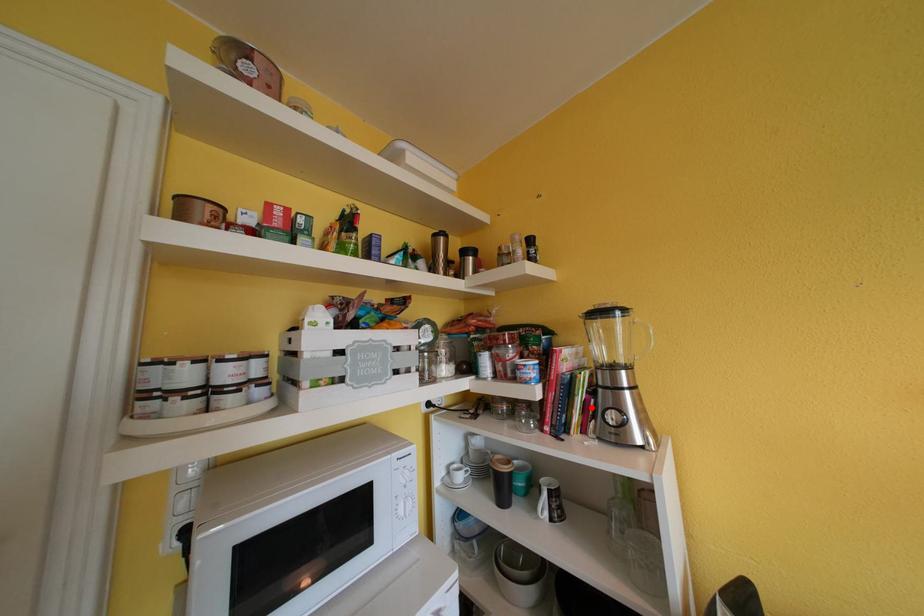
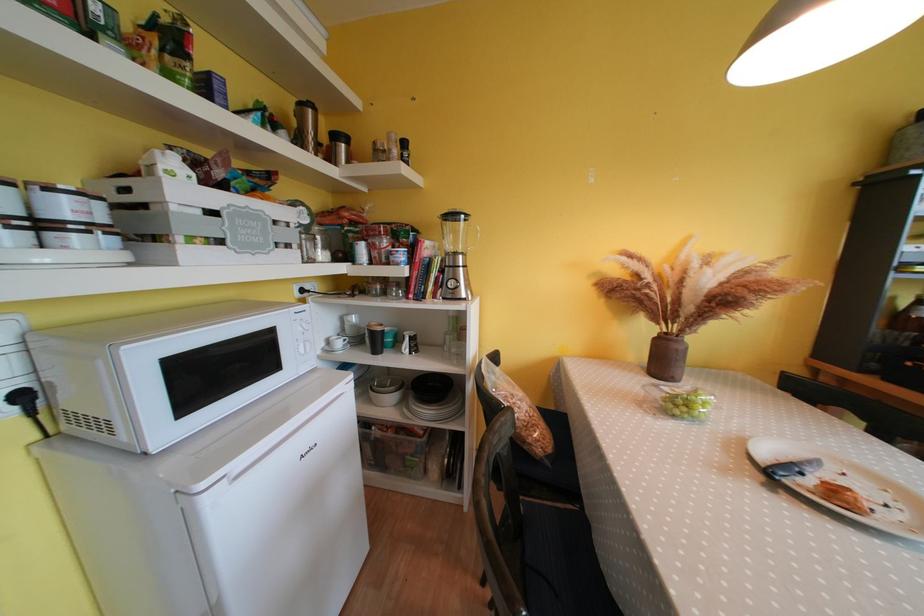
In the second image, find the point that corresponds to the highlighted location in the first image.

(444, 282)